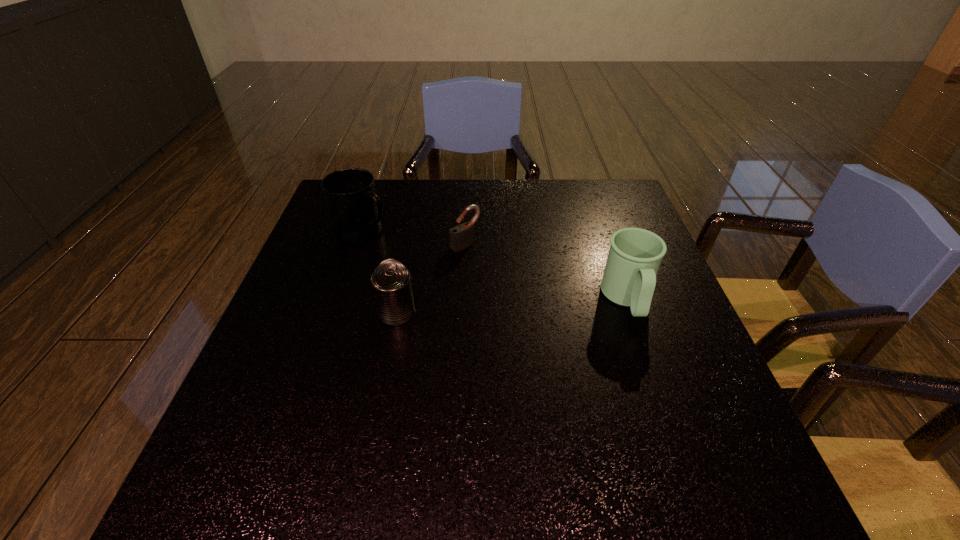
Locate an element on the screen. The image size is (960, 540). vacant space on the desktop that is between the second object from left to right and the nearer mug and is positioned on the side of the left mug with the handle is located at coordinates (523, 306).

Where is `free spot on the desktop that is between the second object from left to right and the nearer mug and is positioned with the keyhole on the front of the second object from right to left`? Image resolution: width=960 pixels, height=540 pixels. free spot on the desktop that is between the second object from left to right and the nearer mug and is positioned with the keyhole on the front of the second object from right to left is located at coordinates (539, 305).